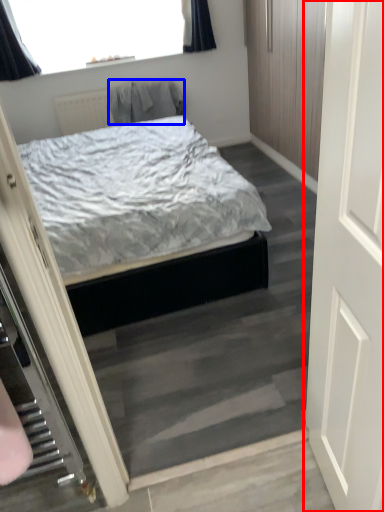
Question: Among these objects, which one is farthest to the camera, door (highlighted by a red box) or robe (highlighted by a blue box)?

Choices:
 (A) door
 (B) robe

Answer: (B)